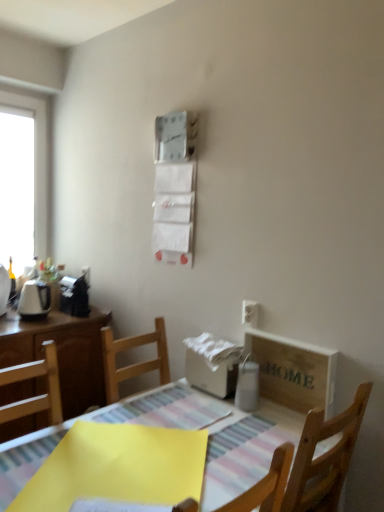
Describe the element at coordinates (24, 180) in the screenshot. This screenshot has width=384, height=512. I see `white glossy window at left` at that location.

Describe the element at coordinates (293, 372) in the screenshot. I see `wooden crate at lower right` at that location.

Find the location of a particular element. white plastic electric outlet at upper right is located at coordinates (250, 313).

Describe the element at coordinates (213, 349) in the screenshot. I see `white paper towel at center` at that location.

This screenshot has width=384, height=512. Identify the location of white glossy window at left. (24, 180).

At what (x,y) coordinates should I click in order to perform the action: click on cardboard box above the yellow paper at lower left (from a real-world perspective). Please return your answer as a coordinate pair (x, y). The width and height of the screenshot is (384, 512). Looking at the image, I should click on (293, 372).

Based on the photo, is wooden crate at lower right wider than yellow paper at lower left?

No, wooden crate at lower right is not wider than yellow paper at lower left.

Who is shorter, wooden crate at lower right or yellow paper at lower left?

With less height is yellow paper at lower left.

From a real-world perspective, relative to yellow paper at lower left, is wooden crate at lower right vertically above or below?

wooden crate at lower right is situated higher than yellow paper at lower left in the real world.

From a real-world perspective, who is located higher, wooden table at center or white glossy window at left?

white glossy window at left is physically above.

Is there a large distance between wooden table at center and white glossy window at left?

That's right, there is a large distance between wooden table at center and white glossy window at left.

How distant is wooden table at center from white glossy window at left?

The distance of wooden table at center from white glossy window at left is 1.95 meters.

From the picture: Does wooden table at center have a smaller size compared to white glossy window at left?

No, wooden table at center is not smaller than white glossy window at left.

Considering the sizes of objects white plastic electric outlet at upper right and white glossy window at left in the image provided, who is bigger, white plastic electric outlet at upper right or white glossy window at left?

white glossy window at left.

Can you tell me how much white plastic electric outlet at upper right and white glossy window at left differ in facing direction?

The angle between the facing direction of white plastic electric outlet at upper right and the facing direction of white glossy window at left is 90 degrees.

Is white plastic electric outlet at upper right placed right next to white glossy window at left?

No, white plastic electric outlet at upper right is not beside white glossy window at left.

Identify the location of electric outlet below the white glossy window at left (from the image's perspective). (250, 313).

Can you confirm if white paper towel at center is positioned to the left of wooden table at center?

Incorrect, white paper towel at center is not on the left side of wooden table at center.

Is white paper towel at center in front of or behind wooden table at center in the image?

white paper towel at center is positioned farther from the viewer than wooden table at center.

Looking at the image, does white paper towel at center seem bigger or smaller compared to wooden table at center?

In the image, white paper towel at center appears to be smaller than wooden table at center.

Is white paper towel at center thinner than wooden table at center?

Yes, white paper towel at center is thinner than wooden table at center.

From the picture: Does wooden crate at lower right touch white glossy window at left?

wooden crate at lower right and white glossy window at left are not in contact.

In the scene shown: Considering the relative sizes of wooden crate at lower right and white glossy window at left in the image provided, is wooden crate at lower right smaller than white glossy window at left?

Indeed, wooden crate at lower right has a smaller size compared to white glossy window at left.

This screenshot has height=512, width=384. I want to click on cardboard box in front of the white glossy window at left, so click(x=293, y=372).

Is white glossy window at left turned away from wooden table at center?

No, white glossy window at left's orientation is not away from wooden table at center.

Is white glossy window at left bigger or smaller than wooden table at center?

white glossy window at left is smaller than wooden table at center.

Locate an element on the screen. The image size is (384, 512). table below the white glossy window at left (from a real-world perspective) is located at coordinates (243, 454).

Which of these two, white glossy window at left or wooden table at center, is thinner?

With smaller width is white glossy window at left.

Is yellow paper at lower left in front of or behind wooden crate at lower right in the image?

yellow paper at lower left is in front of wooden crate at lower right.

Does yellow paper at lower left have a smaller size compared to wooden crate at lower right?

Yes, yellow paper at lower left is smaller than wooden crate at lower right.

From the image's perspective, is yellow paper at lower left over wooden crate at lower right?

No, from the image's perspective, yellow paper at lower left is not over wooden crate at lower right.

Where is `cardboard box that is behind the yellow paper at lower left`? The image size is (384, 512). cardboard box that is behind the yellow paper at lower left is located at coordinates (293, 372).

At what (x,y) coordinates should I click in order to perform the action: click on window that is above the wooden table at center (from the image's perspective). Please return your answer as a coordinate pair (x, y). This screenshot has width=384, height=512. Looking at the image, I should click on (24, 180).

Based on their spatial positions, is white glossy window at left or white plastic electric outlet at upper right closer to wooden crate at lower right?

Among the two, white plastic electric outlet at upper right is located nearer to wooden crate at lower right.

Consider the image. Estimate the real-world distances between objects in this image. Which object is closer to wooden table at center, white glossy window at left or white plastic electric outlet at upper right?

white plastic electric outlet at upper right lies closer to wooden table at center than the other object.

When comparing their distances from yellow paper at lower left, does white paper towel at center or white plastic electric outlet at upper right seem further?

white plastic electric outlet at upper right is positioned further to the anchor yellow paper at lower left.

Estimate the real-world distances between objects in this image. Which object is further from white glossy window at left, wooden table at center or white plastic electric outlet at upper right?

white plastic electric outlet at upper right lies further to white glossy window at left than the other object.

Looking at the image, which one is located closer to wooden crate at lower right, wooden table at center or white glossy window at left?

wooden table at center is positioned closer to the anchor wooden crate at lower right.

Which object lies nearer to the anchor point yellow paper at lower left, white glossy window at left or wooden table at center?

Based on the image, wooden table at center appears to be nearer to yellow paper at lower left.

Estimate the real-world distances between objects in this image. Which object is further from white paper towel at center, white plastic electric outlet at upper right or white glossy window at left?

Among the two, white glossy window at left is located further to white paper towel at center.

Considering their positions, is white paper towel at center positioned closer to white plastic electric outlet at upper right than wooden crate at lower right?

Among the two, white paper towel at center is located nearer to white plastic electric outlet at upper right.

You are a GUI agent. You are given a task and a screenshot of the screen. Output one action in this format:
    pyautogui.click(x=<x>, y=<y>)
    Task: Click on the electric outlet located between white glossy window at left and wooden crate at lower right in the left-right direction
    
    Given the screenshot: What is the action you would take?
    pyautogui.click(x=250, y=313)

Where is `cardboard box positioned between yellow paper at lower left and white plastic electric outlet at upper right from near to far`? Image resolution: width=384 pixels, height=512 pixels. cardboard box positioned between yellow paper at lower left and white plastic electric outlet at upper right from near to far is located at coordinates (293, 372).

Where is `cloth positioned between wooden table at center and white paper towel at center from near to far`? cloth positioned between wooden table at center and white paper towel at center from near to far is located at coordinates (117, 467).

Image resolution: width=384 pixels, height=512 pixels. In order to click on cloth between wooden table at center and wooden crate at lower right along the z-axis in this screenshot , I will do `click(117, 467)`.